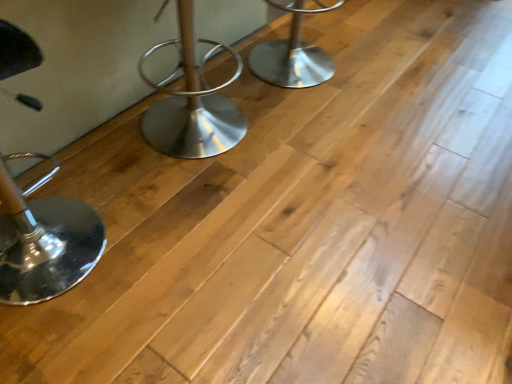
Identify the location of vacant space underneath polished chrome stool at left, marked as the first furniture in a bottom-to-top arrangement (from a real-world perspective). (75, 258).